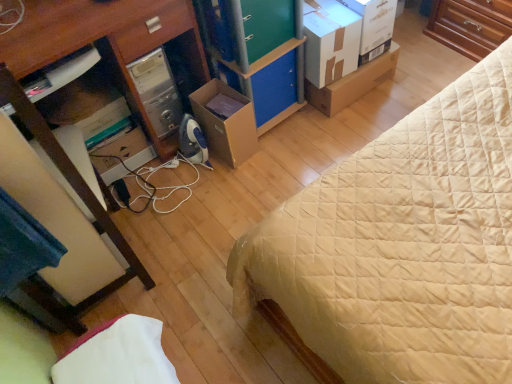
At what (x,y) coordinates should I click in order to perform the action: click on beige quilted bed at center. Please return your answer as a coordinate pair (x, y). This screenshot has width=512, height=384. Looking at the image, I should click on [400, 247].

This screenshot has height=384, width=512. What do you see at coordinates (113, 76) in the screenshot? I see `wooden desk at left` at bounding box center [113, 76].

The width and height of the screenshot is (512, 384). What do you see at coordinates (330, 41) in the screenshot?
I see `white cardboard box at upper right, which ranks as the second cardboard box in left-to-right order` at bounding box center [330, 41].

This screenshot has width=512, height=384. What are the coordinates of `brown cardboard box at center, which is counted as the 3th cardboard box, starting from the right` in the screenshot? It's located at (226, 122).

Image resolution: width=512 pixels, height=384 pixels. I want to click on beige quilted bed at center, so click(x=400, y=247).

Does point (215, 149) lie behind point (492, 353)?

Yes, point (215, 149) is farther from viewer.

Who is shorter, brown cardboard box at center, which is counted as the 3th cardboard box, starting from the right, or beige quilted bed at center?

Standing shorter between the two is brown cardboard box at center, which is counted as the 3th cardboard box, starting from the right.

Consider the image. Is brown cardboard box at center, which is the 1th cardboard box from left to right, touching beige quilted bed at center?

No.

Locate an element on the screen. This screenshot has height=384, width=512. the 1st cardboard box directly beneath the blue felt drawer at center, the first drawer when ordered from bottom to top (from a real-world perspective) is located at coordinates (226, 122).

Are blue felt drawer at center, which is the 2th drawer in top-to-bottom order, and brown cardboard box at center, which is counted as the 3th cardboard box, starting from the right, making contact?

There is a gap between blue felt drawer at center, which is the 2th drawer in top-to-bottom order, and brown cardboard box at center, which is counted as the 3th cardboard box, starting from the right.

Based on their sizes in the image, would you say blue felt drawer at center, the first drawer when ordered from bottom to top, is bigger or smaller than brown cardboard box at center, which is counted as the 3th cardboard box, starting from the right?

In the image, blue felt drawer at center, the first drawer when ordered from bottom to top, appears to be smaller than brown cardboard box at center, which is counted as the 3th cardboard box, starting from the right.

Does blue felt drawer at center, which is the 2th drawer in top-to-bottom order, appear on the right side of brown cardboard box at center, which is the 1th cardboard box from left to right?

Indeed, blue felt drawer at center, which is the 2th drawer in top-to-bottom order, is positioned on the right side of brown cardboard box at center, which is the 1th cardboard box from left to right.

Considering the positions of objects white soft mattress at lower left and blue felt drawer at center, which is the 2th drawer in top-to-bottom order, in the image provided, who is in front, white soft mattress at lower left or blue felt drawer at center, which is the 2th drawer in top-to-bottom order,?

white soft mattress at lower left.

Does white soft mattress at lower left have a greater height compared to blue felt drawer at center, which is the 2th drawer in top-to-bottom order?

Indeed, white soft mattress at lower left has a greater height compared to blue felt drawer at center, which is the 2th drawer in top-to-bottom order.

From the image's perspective, is white soft mattress at lower left positioned above or below blue felt drawer at center, which is the 2th drawer in top-to-bottom order?

white soft mattress at lower left is below blue felt drawer at center, which is the 2th drawer in top-to-bottom order.

Which is nearer, (94, 379) or (286, 68)?

Positioned in front is point (94, 379).

Could you tell me if white soft mattress at lower left is facing brown cardboard box at center, which is counted as the 3th cardboard box, starting from the right?

No, white soft mattress at lower left does not turn towards brown cardboard box at center, which is counted as the 3th cardboard box, starting from the right.

Which of these two, white soft mattress at lower left or brown cardboard box at center, which is the 1th cardboard box from left to right, stands shorter?

With less height is white soft mattress at lower left.

Does white soft mattress at lower left have a smaller size compared to brown cardboard box at center, which is counted as the 3th cardboard box, starting from the right?

No, white soft mattress at lower left is not smaller than brown cardboard box at center, which is counted as the 3th cardboard box, starting from the right.

Is white soft mattress at lower left to the left of brown cardboard box at center, which is the 1th cardboard box from left to right, from the viewer's perspective?

Correct, you'll find white soft mattress at lower left to the left of brown cardboard box at center, which is the 1th cardboard box from left to right.

Is brown cardboard box at center, which is counted as the 3th cardboard box, starting from the right, looking in the opposite direction of green matte drawer at center, placed as the first drawer when sorted from top to bottom?

No, brown cardboard box at center, which is counted as the 3th cardboard box, starting from the right, is not facing the opposite direction of green matte drawer at center, placed as the first drawer when sorted from top to bottom.

From a real-world perspective, which object stands above the other?

In real-world perspective, green matte drawer at center, the second drawer when ordered from bottom to top, is above.

Consider the image. Can you confirm if brown cardboard box at center, which is the 1th cardboard box from left to right, is taller than green matte drawer at center, placed as the first drawer when sorted from top to bottom?

Indeed, brown cardboard box at center, which is the 1th cardboard box from left to right, has a greater height compared to green matte drawer at center, placed as the first drawer when sorted from top to bottom.

Is brown cardboard box at center, which is counted as the 3th cardboard box, starting from the right, in front of or behind green matte drawer at center, placed as the first drawer when sorted from top to bottom, in the image?

Clearly, brown cardboard box at center, which is counted as the 3th cardboard box, starting from the right, is behind green matte drawer at center, placed as the first drawer when sorted from top to bottom.

You are a GUI agent. You are given a task and a screenshot of the screen. Output one action in this format:
    pyautogui.click(x=<x>, y=<y>)
    Task: Click on the bed that appears above the wooden desk at left (from the image's perspective)
    Image resolution: width=512 pixels, height=384 pixels.
    Given the screenshot: What is the action you would take?
    pyautogui.click(x=400, y=247)

Does beige quilted bed at center have a lesser width compared to wooden desk at left?

Incorrect, the width of beige quilted bed at center is not less than that of wooden desk at left.

From a real-world perspective, is beige quilted bed at center positioned over wooden desk at left based on gravity?

No, from a real-world perspective, beige quilted bed at center is not over wooden desk at left

Is beige quilted bed at center with wooden desk at left?

No, beige quilted bed at center is not with wooden desk at left.

Considering the relative positions of blue felt drawer at center, which is the 2th drawer in top-to-bottom order, and white soft mattress at lower left in the image provided, is blue felt drawer at center, which is the 2th drawer in top-to-bottom order, to the right of white soft mattress at lower left from the viewer's perspective?

Correct, you'll find blue felt drawer at center, which is the 2th drawer in top-to-bottom order, to the right of white soft mattress at lower left.

Is blue felt drawer at center, the first drawer when ordered from bottom to top, aimed at white soft mattress at lower left?

No, blue felt drawer at center, the first drawer when ordered from bottom to top, is not turned towards white soft mattress at lower left.

Is the depth of blue felt drawer at center, the first drawer when ordered from bottom to top, greater than that of white soft mattress at lower left?

Yes, blue felt drawer at center, the first drawer when ordered from bottom to top, is behind white soft mattress at lower left.

Are blue felt drawer at center, the first drawer when ordered from bottom to top, and white soft mattress at lower left far apart?

blue felt drawer at center, the first drawer when ordered from bottom to top, is far away from white soft mattress at lower left.

At what (x,y) coordinates should I click in order to perform the action: click on the 2nd cardboard box positioned below the beige quilted bed at center (from a real-world perspective). Please return your answer as a coordinate pair (x, y). Looking at the image, I should click on (226, 122).

Locate an element on the screen. cardboard box to the left of blue felt drawer at center, the first drawer when ordered from bottom to top is located at coordinates (226, 122).

From the image, which object appears to be nearer to white cardboard box at upper right, blue felt drawer at center, which is the 2th drawer in top-to-bottom order, or green matte cabinet at center?

The object closer to white cardboard box at upper right is blue felt drawer at center, which is the 2th drawer in top-to-bottom order.

Which object lies further to the anchor point blue felt drawer at center, the first drawer when ordered from bottom to top, beige quilted bed at center or wooden desk at left?

beige quilted bed at center is further to blue felt drawer at center, the first drawer when ordered from bottom to top.

From the image, which object appears to be nearer to green matte drawer at center, the second drawer when ordered from bottom to top, brown wood dresser at upper right or white cardboard box at upper right?

white cardboard box at upper right.

From the picture: Looking at the image, which one is located closer to brown cardboard box at center, which is counted as the 3th cardboard box, starting from the right, brown wood dresser at upper right or white cardboard box at upper right?

The object closer to brown cardboard box at center, which is counted as the 3th cardboard box, starting from the right, is white cardboard box at upper right.

Which object lies further to the anchor point green matte drawer at center, placed as the first drawer when sorted from top to bottom, green matte cabinet at center or white soft mattress at lower left?

Based on the image, white soft mattress at lower left appears to be further to green matte drawer at center, placed as the first drawer when sorted from top to bottom.

Estimate the real-world distances between objects in this image. Which object is closer to green matte cabinet at center, brown wood dresser at upper right or beige quilted bed at center?

beige quilted bed at center is closer to green matte cabinet at center.

From the image, which object appears to be nearer to white cardboard box at upper right, which ranks as the second cardboard box in left-to-right order, green matte cabinet at center or blue felt drawer at center, the first drawer when ordered from bottom to top?

blue felt drawer at center, the first drawer when ordered from bottom to top, lies closer to white cardboard box at upper right, which ranks as the second cardboard box in left-to-right order, than the other object.

From the picture: From the image, which object appears to be farther from white soft mattress at lower left, brown wood dresser at upper right or white cardboard box at upper right?

brown wood dresser at upper right is further to white soft mattress at lower left.

The width and height of the screenshot is (512, 384). Find the location of `bed between green matte cabinet at center and white soft mattress at lower left from top to bottom`. bed between green matte cabinet at center and white soft mattress at lower left from top to bottom is located at coordinates (400, 247).

You are a GUI agent. You are given a task and a screenshot of the screen. Output one action in this format:
    pyautogui.click(x=<x>, y=<y>)
    Task: Click on the storage box between blue felt drawer at center, which is the 2th drawer in top-to-bottom order, and brown wood dresser at upper right from left to right
    This screenshot has width=512, height=384.
    Given the screenshot: What is the action you would take?
    pyautogui.click(x=374, y=21)

Locate an element on the screen. The height and width of the screenshot is (384, 512). dresser positioned between beige quilted bed at center and cardboard box at center, which is the first cardboard box from right to left, from near to far is located at coordinates (257, 52).

Image resolution: width=512 pixels, height=384 pixels. In order to click on storage box located between green matte cabinet at center and brown wood dresser at upper right in the left-right direction in this screenshot , I will do `click(374, 21)`.